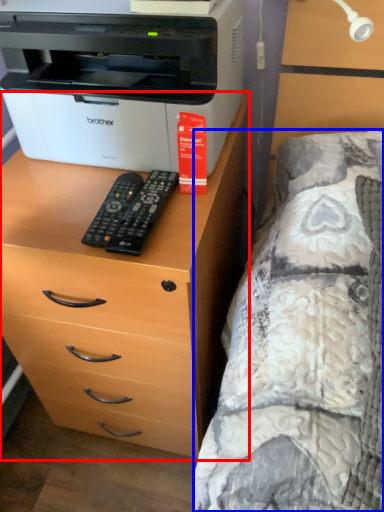
Question: Which object is further to the camera taking this photo, chest of drawers (highlighted by a red box) or bed (highlighted by a blue box)?

Choices:
 (A) chest of drawers
 (B) bed

Answer: (A)